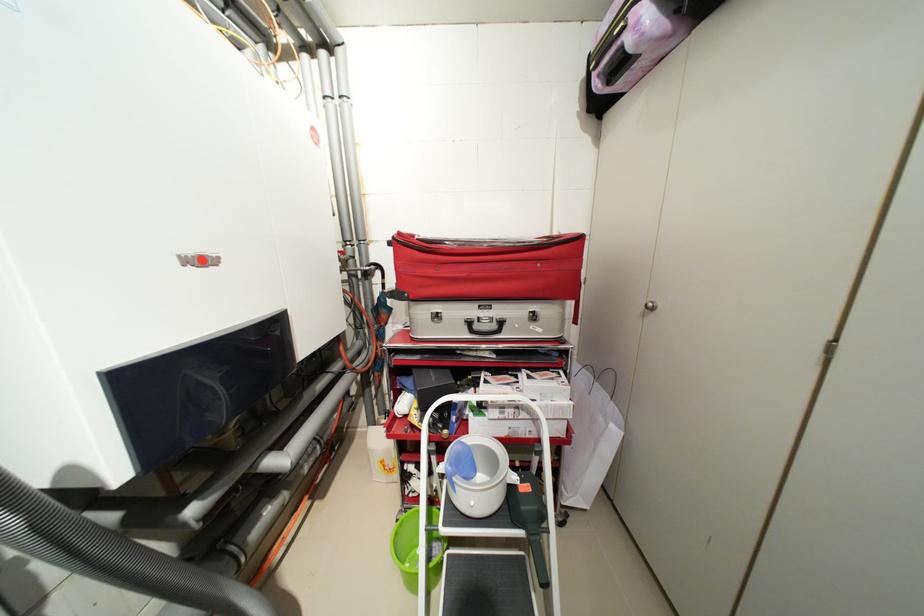
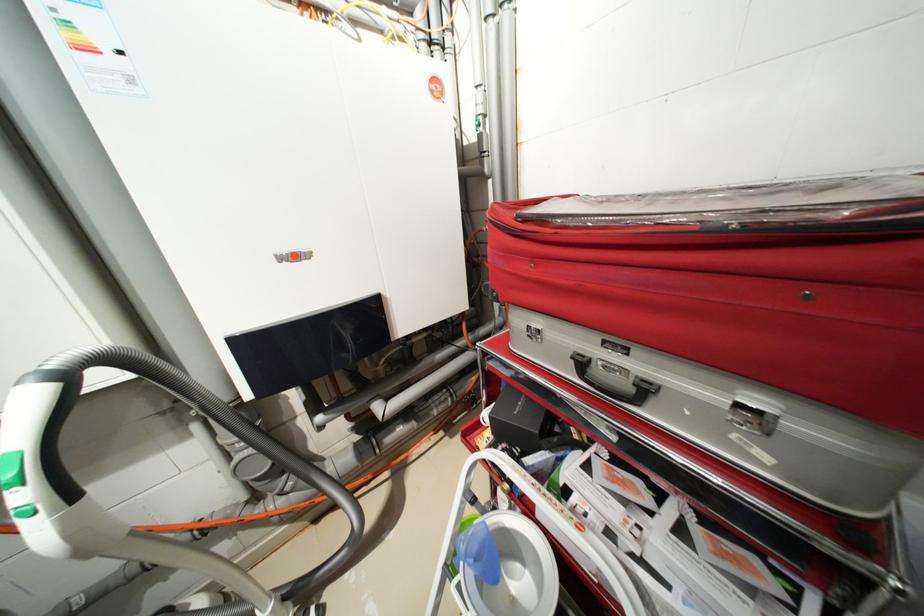
In the second image, find the point that corresponds to pixel 477 323 in the first image.

(589, 363)